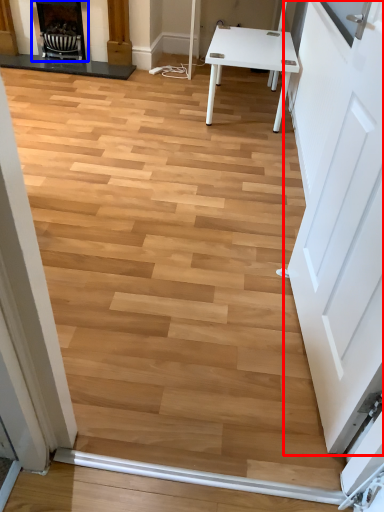
Question: Which point is further to the camera, door (highlighted by a red box) or fireplace (highlighted by a blue box)?

Choices:
 (A) door
 (B) fireplace

Answer: (B)